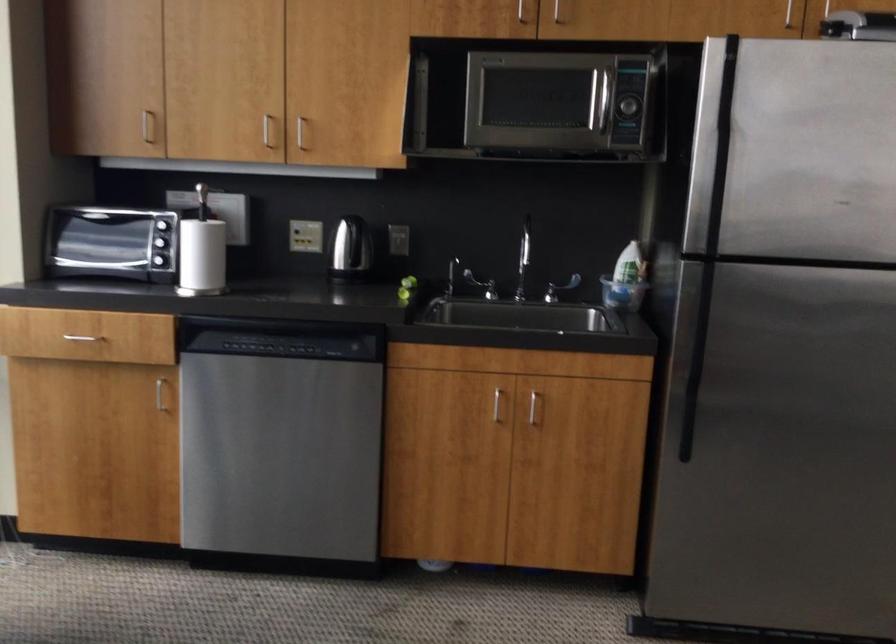
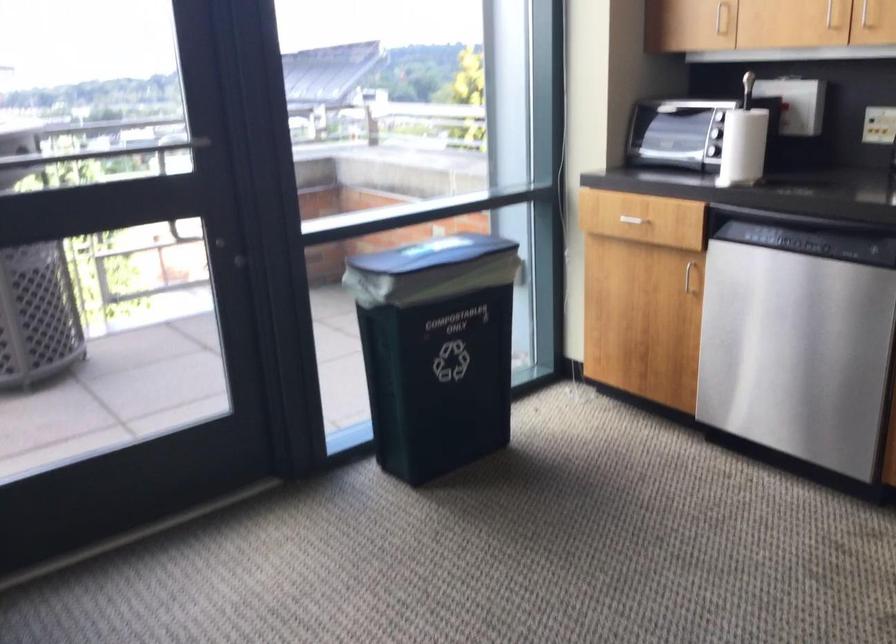
Where in the second image is the point corresponding to pixel 164 393 from the first image?

(690, 276)